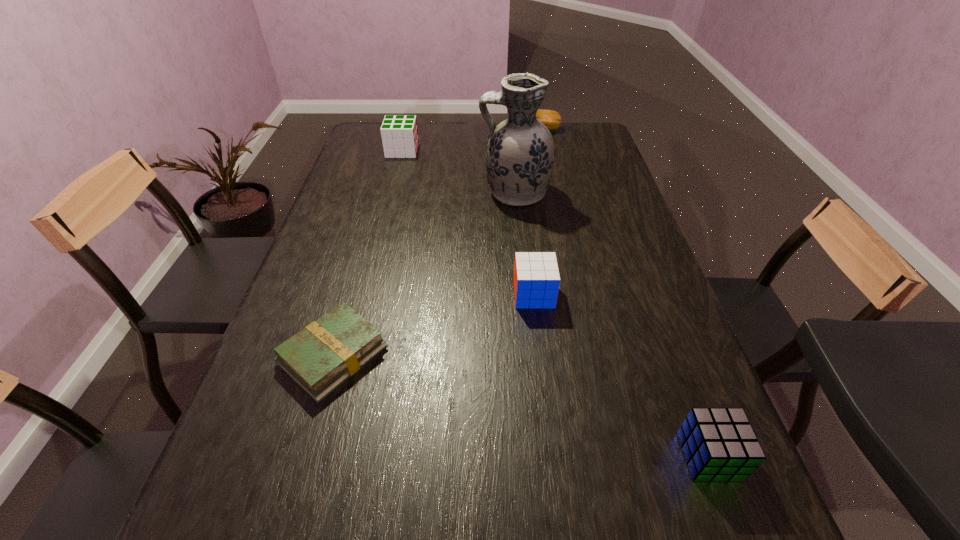
The image size is (960, 540). I want to click on book, so (x=319, y=358).

The width and height of the screenshot is (960, 540). In order to click on free space located 0.070m with the handle on the side of the tallest object in this screenshot , I will do `click(457, 193)`.

At what (x,y) coordinates should I click in order to perform the action: click on vacant space located with the handle on the side of the tallest object. Please return your answer as a coordinate pair (x, y). The width and height of the screenshot is (960, 540). Looking at the image, I should click on (412, 193).

The image size is (960, 540). Identify the location of blank area located 0.390m with the handle on the side of the tallest object. (355, 193).

I want to click on vacant space located on the red face of the leftmost cube, so click(x=470, y=151).

Find the location of a particular element. This screenshot has height=540, width=960. free space located on the stem side of the farthest object is located at coordinates tap(452, 130).

Where is `vacant space located on the stem side of the farthest object`? vacant space located on the stem side of the farthest object is located at coordinates (423, 130).

Find the location of a particular element. This screenshot has width=960, height=540. free space located on the stem side of the farthest object is located at coordinates (437, 130).

Locate an element on the screen. vacant space located 0.170m on the front of the fourth farthest object is located at coordinates (543, 370).

The width and height of the screenshot is (960, 540). Identify the location of free space located on the back of the nearest object. (660, 325).